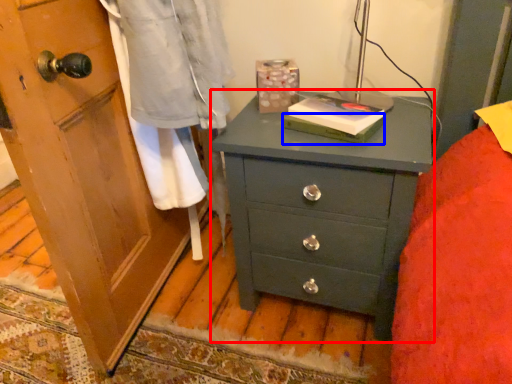
Question: Among these objects, which one is farthest to the camera, chest of drawers (highlighted by a red box) or book (highlighted by a blue box)?

Choices:
 (A) chest of drawers
 (B) book

Answer: (B)